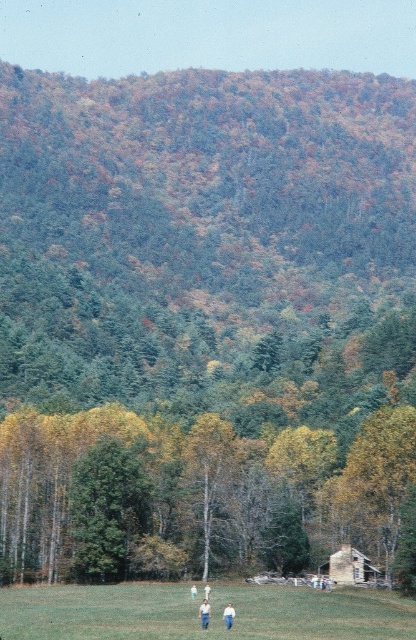
You are standing in the middle of the open grassy field in the scene. You see a point marked at coordinates [198,612]. What is the location of this point relative to the green grass at lower center?

The point at coordinates [198,612] is exactly where the green grass at lower center is located.

You are a hiker who wants to identify two people in the grassy field. You see a white cotton shirt at lower center and a white cotton shirt at center. Which one appears taller?

The white cotton shirt at lower center appears much taller than the white cotton shirt at center.